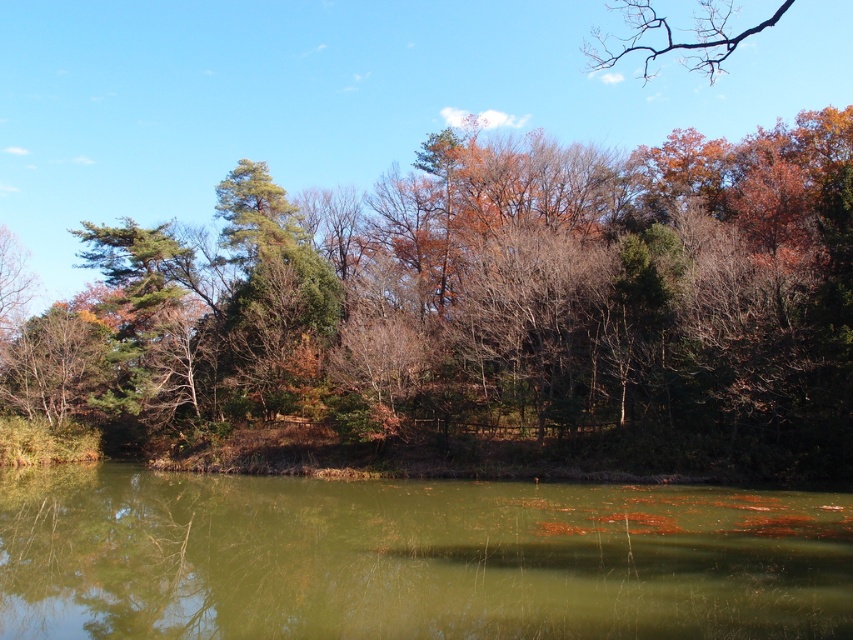
Who is positioned more to the left, green leafy tree at center or green murky water at center?

Positioned to the left is green murky water at center.

Is point (619, 372) closer to camera compared to point (50, 625)?

No, (619, 372) is further to viewer.

Where is `green leafy tree at center`? This screenshot has width=853, height=640. green leafy tree at center is located at coordinates (480, 310).